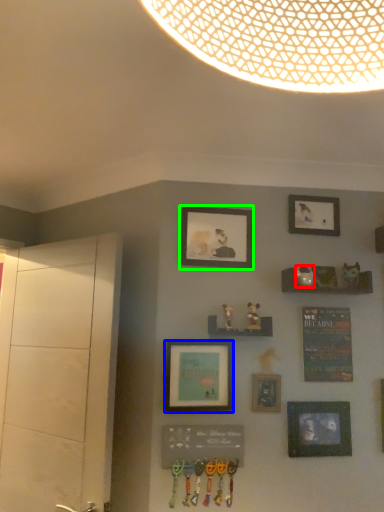
Question: Which object is the closest to the art (highlighted by a red box)? Choose among these: picture frame (highlighted by a blue box) or picture frame (highlighted by a green box).

Choices:
 (A) picture frame
 (B) picture frame

Answer: (B)